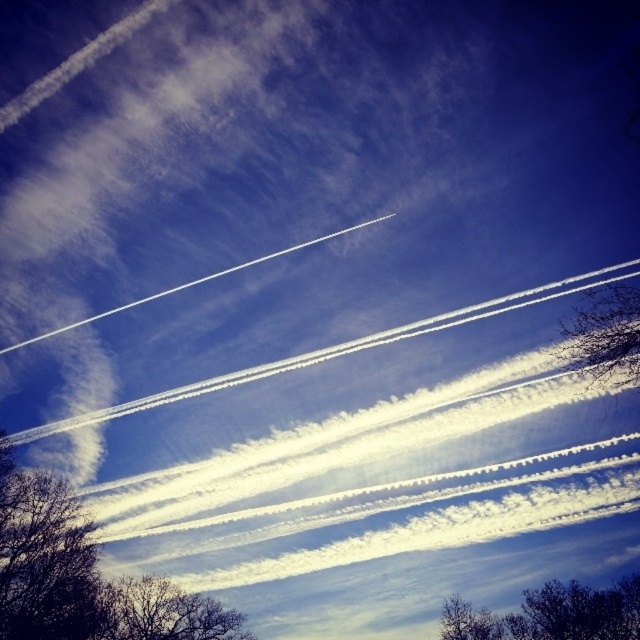
Can you confirm if silhouette bare tree at bottom left is positioned above bare branches at bottom?

Correct, silhouette bare tree at bottom left is located above bare branches at bottom.

Who is more forward, (90,621) or (484,620)?

Point (484,620) is more forward.

What are the coordinates of `silhouette bare tree at bottom left` in the screenshot? It's located at (83, 573).

Which is behind, point (132, 609) or point (573, 365)?

Positioned behind is point (132, 609).

Between brown textured tree at lower left and bare branches at right, which one is positioned lower?

Positioned lower is brown textured tree at lower left.

Who is more forward, (148, 589) or (586, 362)?

Positioned in front is point (586, 362).

Locate an element on the screen. Image resolution: width=640 pixels, height=640 pixels. brown textured tree at lower left is located at coordinates (163, 612).

Between silhouette bare tree at bottom left and dark brown textured tree at lower left, which one has more height?

With more height is silhouette bare tree at bottom left.

Is silhouette bare tree at bottom left below dark brown textured tree at lower left?

Yes, silhouette bare tree at bottom left is below dark brown textured tree at lower left.

Does point (17, 522) lie in front of point (58, 508)?

Yes, point (17, 522) is closer to viewer.

Locate an element on the screen. The width and height of the screenshot is (640, 640). silhouette bare tree at bottom left is located at coordinates (83, 573).